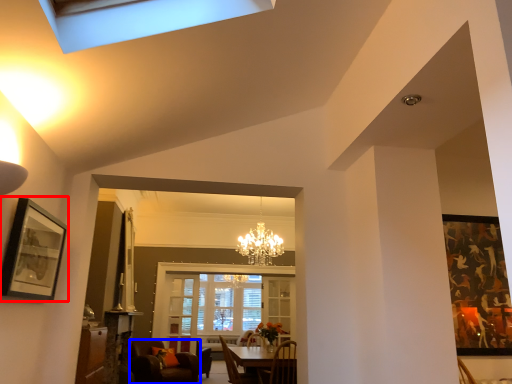
Question: Which object is closer to the camera taking this photo, picture frame (highlighted by a red box) or chair (highlighted by a blue box)?

Choices:
 (A) picture frame
 (B) chair

Answer: (A)